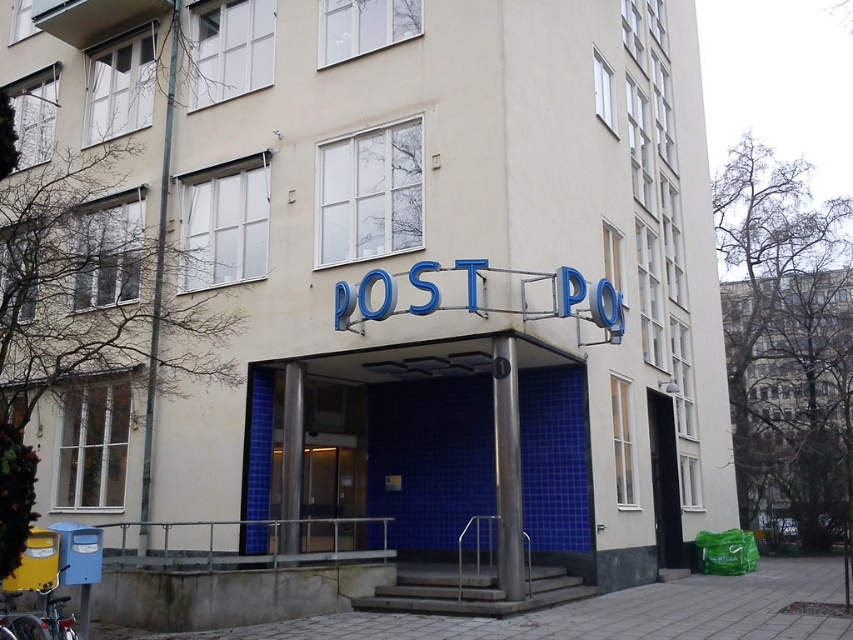
Does glass door at center have a greater width compared to black glass door at center?

In fact, glass door at center might be narrower than black glass door at center.

What do you see at coordinates (331, 481) in the screenshot? The image size is (853, 640). I see `glass door at center` at bounding box center [331, 481].

This screenshot has width=853, height=640. What are the coordinates of `glass door at center` in the screenshot? It's located at (331, 481).

Is point (751, 484) in front of point (666, 509)?

No, it is behind (666, 509).

Who is more distant from viewer, (753, 420) or (680, 550)?

Positioned behind is point (753, 420).

Identify the location of blue tile building at center. (791, 392).

Can you confirm if blue tile building at center is positioned to the right of glass door at center?

Correct, you'll find blue tile building at center to the right of glass door at center.

Locate an element on the screen. This screenshot has width=853, height=640. blue tile building at center is located at coordinates (791, 392).